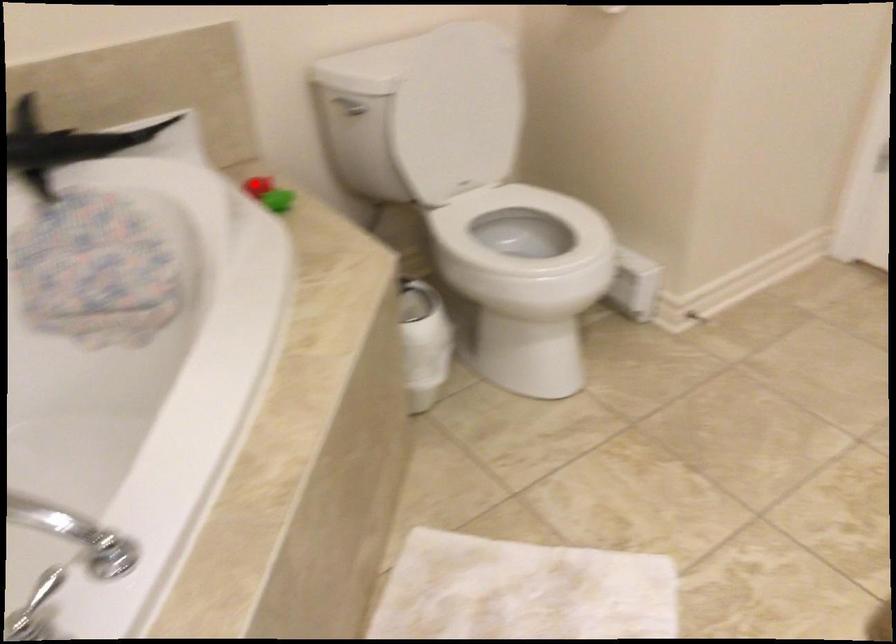
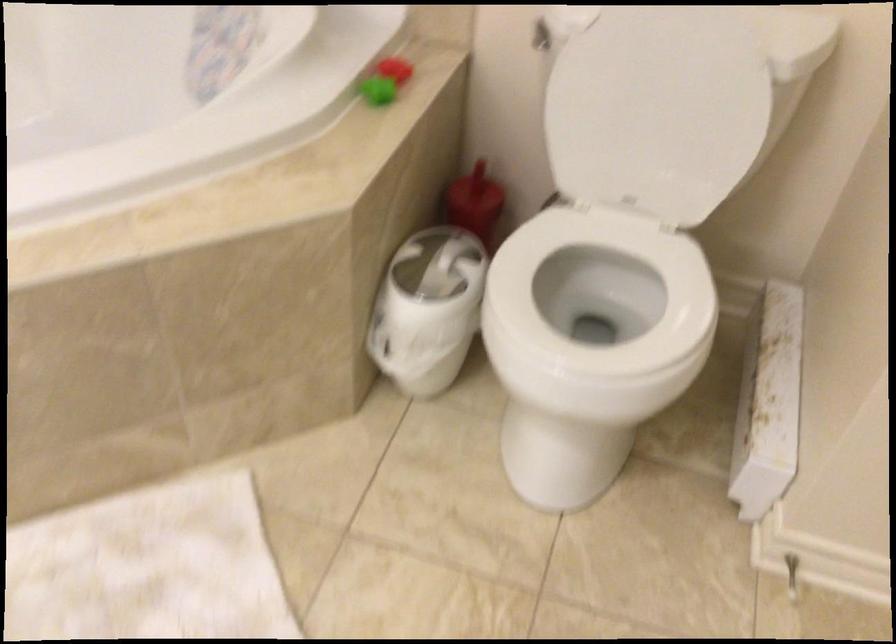
In the second image, find the point that corresponds to the highlighted location in the first image.

(394, 69)